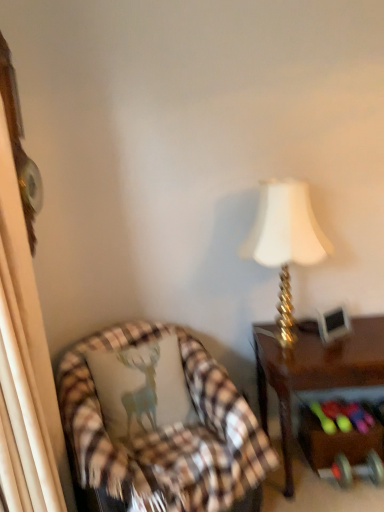
Question: Would you say plaid fabric pillow at left is inside or outside gold metallic lamp at upper right?

Choices:
 (A) outside
 (B) inside

Answer: (A)

Question: Considering the relative positions of plaid fabric pillow at left and gold metallic lamp at upper right in the image provided, is plaid fabric pillow at left to the left or to the right of gold metallic lamp at upper right?

Choices:
 (A) right
 (B) left

Answer: (B)

Question: Estimate the real-world distances between objects in this image. Which object is closer to the brown wooden desk at right?

Choices:
 (A) metallic silver dumbbell at lower right
 (B) brown plaid chair at lower left
 (C) plaid fabric pillow at left
 (D) gold metallic lamp at upper right

Answer: (A)

Question: Which is farther from the brown plaid chair at lower left?

Choices:
 (A) metallic silver dumbbell at lower right
 (B) gold metallic lamp at upper right
 (C) brown wooden desk at right
 (D) plaid fabric pillow at left

Answer: (A)